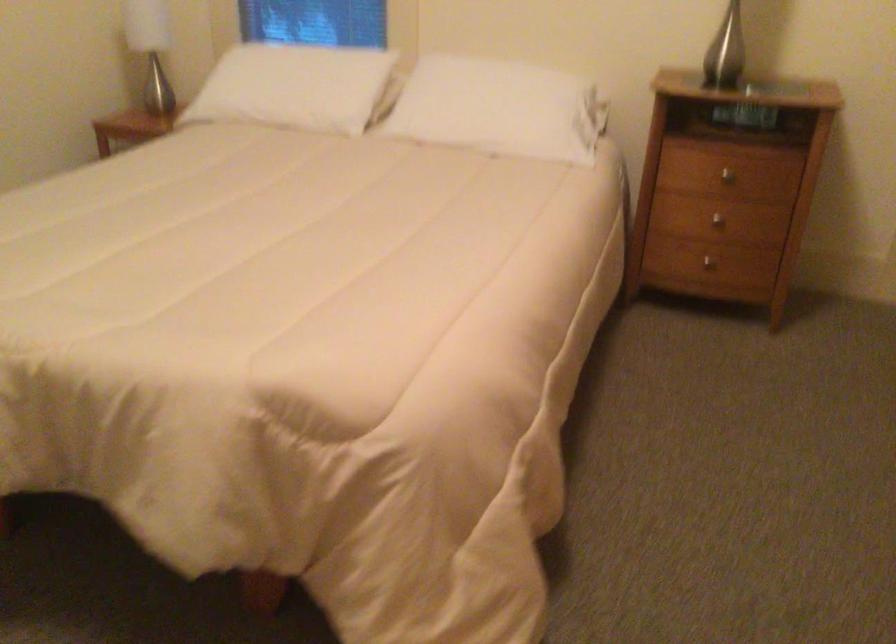
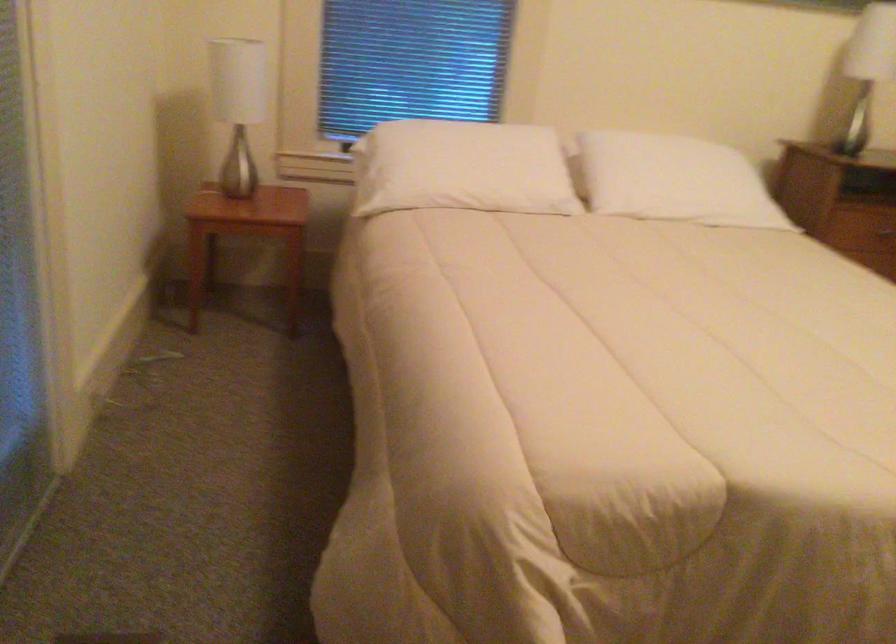
Find the pixel in the second image that matches point 454,113 in the first image.

(673, 180)